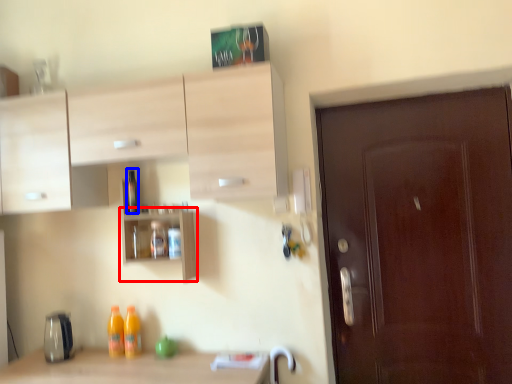
Question: Which of the following is the farthest to the observer, shelf (highlighted by a red box) or bottle (highlighted by a blue box)?

Choices:
 (A) shelf
 (B) bottle

Answer: (B)